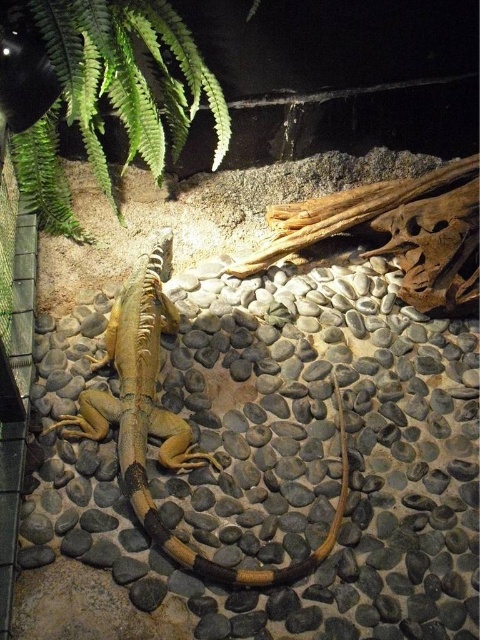
Question: Which of the following is the farthest from the observer?

Choices:
 (A) smooth tan lizard at center
 (B) green leafy plant at upper left

Answer: (A)

Question: Is green leafy plant at upper left in front of smooth tan lizard at center?

Choices:
 (A) yes
 (B) no

Answer: (A)

Question: Is green leafy plant at upper left closer to the viewer compared to smooth tan lizard at center?

Choices:
 (A) no
 (B) yes

Answer: (B)

Question: Can you confirm if green leafy plant at upper left is bigger than smooth tan lizard at center?

Choices:
 (A) yes
 (B) no

Answer: (B)

Question: Which point is closer to the camera taking this photo?

Choices:
 (A) (241, 577)
 (B) (182, 60)

Answer: (A)